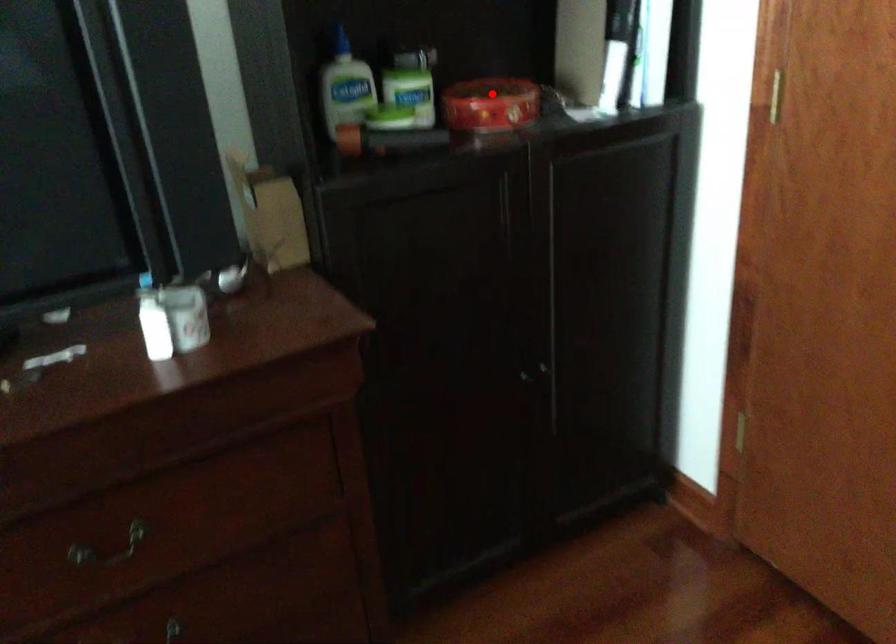
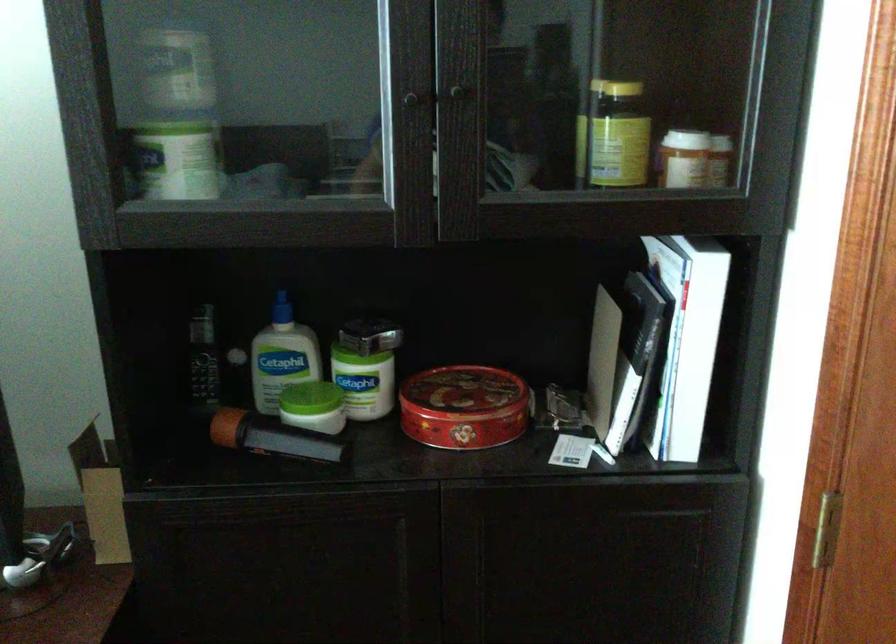
Locate, in the second image, the point that corresponds to the highlighted location in the first image.

(462, 393)